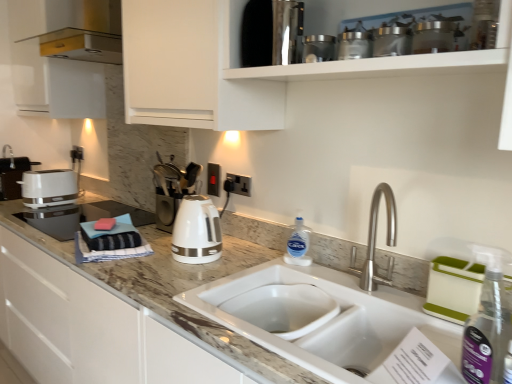
Question: From a real-world perspective, does white glossy toaster at left sit lower than metallic glass jars at upper center, the 1th appliance from the right?

Choices:
 (A) no
 (B) yes

Answer: (B)

Question: From the image's perspective, is white glossy toaster at left located beneath metallic glass jars at upper center, which is the fifth appliance in back-to-front order?

Choices:
 (A) no
 (B) yes

Answer: (B)

Question: Is white glossy toaster at left smaller than metallic glass jars at upper center, the 1th appliance from the right?

Choices:
 (A) yes
 (B) no

Answer: (B)

Question: Considering the relative positions of white glossy toaster at left and metallic glass jars at upper center, which is the fifth appliance in back-to-front order, in the image provided, is white glossy toaster at left to the left of metallic glass jars at upper center, which is the fifth appliance in back-to-front order, from the viewer's perspective?

Choices:
 (A) yes
 (B) no

Answer: (A)

Question: Can you see white glossy toaster at left touching metallic glass jars at upper center, the 1th appliance from the right?

Choices:
 (A) yes
 (B) no

Answer: (B)

Question: From the image's perspective, is white glossy toaster at left above metallic glass jars at upper center, the 1th appliance from the right?

Choices:
 (A) no
 (B) yes

Answer: (A)

Question: From a real-world perspective, is stainless steel coffee maker at upper center, the second appliance viewed from the left, below white glossy electric kettle at center?

Choices:
 (A) yes
 (B) no

Answer: (B)

Question: Is stainless steel coffee maker at upper center, the second appliance viewed from the left, aimed at white glossy electric kettle at center?

Choices:
 (A) no
 (B) yes

Answer: (A)

Question: Does stainless steel coffee maker at upper center, the second appliance viewed from the left, have a lesser width compared to white glossy electric kettle at center?

Choices:
 (A) yes
 (B) no

Answer: (B)

Question: Considering the relative positions of stainless steel coffee maker at upper center, acting as the 4th appliance starting from the right, and white glossy electric kettle at center in the image provided, is stainless steel coffee maker at upper center, acting as the 4th appliance starting from the right, to the left of white glossy electric kettle at center from the viewer's perspective?

Choices:
 (A) no
 (B) yes

Answer: (A)

Question: Is stainless steel coffee maker at upper center, acting as the 4th appliance starting from the right, closer to camera compared to white glossy electric kettle at center?

Choices:
 (A) no
 (B) yes

Answer: (B)

Question: Is stainless steel coffee maker at upper center, the second appliance viewed from the left, outside of white glossy electric kettle at center?

Choices:
 (A) yes
 (B) no

Answer: (A)

Question: Is metallic silver canisters at upper center, which is the fourth appliance from back to front, facing towards white glossy toaster at left?

Choices:
 (A) yes
 (B) no

Answer: (B)